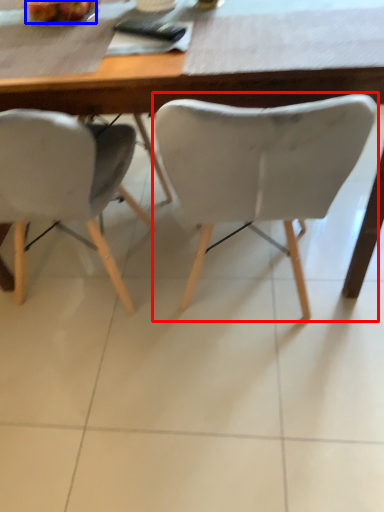
Question: Which object is further to the camera taking this photo, chair (highlighted by a red box) or fruit (highlighted by a blue box)?

Choices:
 (A) chair
 (B) fruit

Answer: (B)